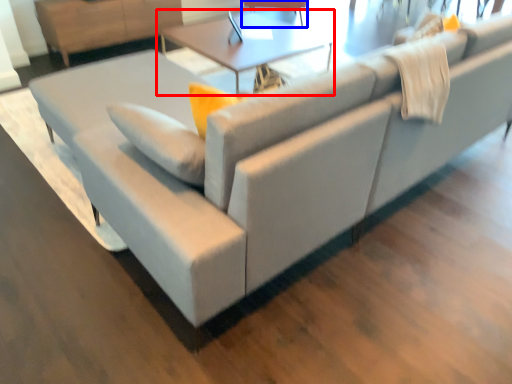
Question: Which of the following is the farthest to the observer, table (highlighted by a red box) or swivel chair (highlighted by a blue box)?

Choices:
 (A) table
 (B) swivel chair

Answer: (B)